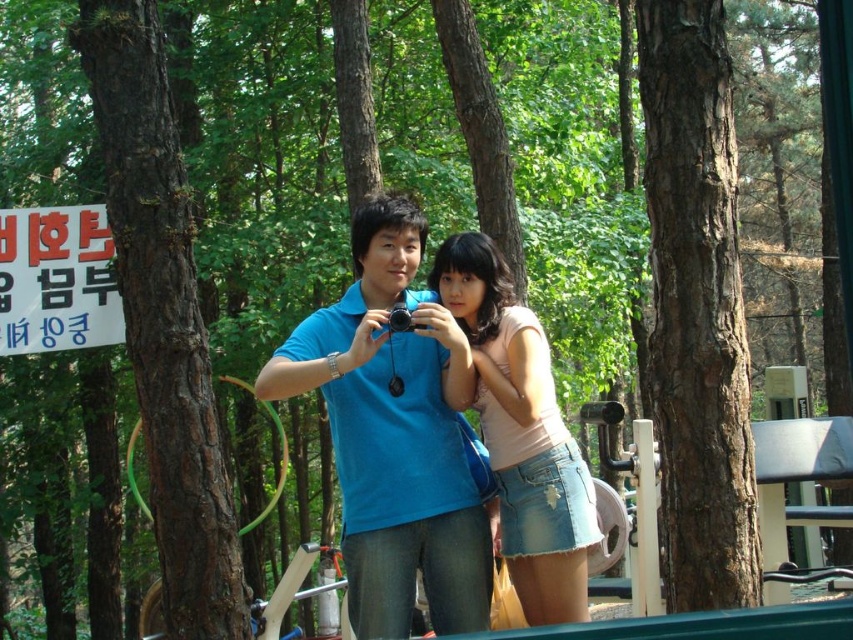
From the picture: You are a photographer trying to adjust your focus. You have two points in the image you need to focus on, point (700, 428) and point (573, 488). Which point is closer to the camera and should be in focus first?

Point (700, 428) is further to the camera than point (573, 488), so point (573, 488) is closer and should be focused first.